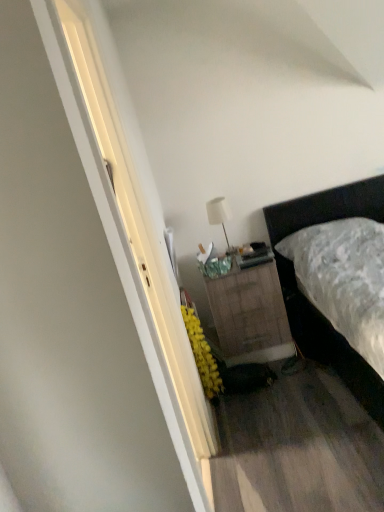
Question: Is dark brown leather bed at right shorter than burlap-textured nightstand at center?

Choices:
 (A) yes
 (B) no

Answer: (B)

Question: Does dark brown leather bed at right lie behind burlap-textured nightstand at center?

Choices:
 (A) yes
 (B) no

Answer: (B)

Question: Is dark brown leather bed at right facing towards burlap-textured nightstand at center?

Choices:
 (A) no
 (B) yes

Answer: (A)

Question: Is dark brown leather bed at right outside burlap-textured nightstand at center?

Choices:
 (A) no
 (B) yes

Answer: (B)

Question: From the image's perspective, is dark brown leather bed at right located above burlap-textured nightstand at center?

Choices:
 (A) yes
 (B) no

Answer: (A)

Question: From the image's perspective, is white matte table lamp at upper center positioned above or below dark brown leather bed at right?

Choices:
 (A) above
 (B) below

Answer: (A)

Question: Is white matte table lamp at upper center to the left or to the right of dark brown leather bed at right in the image?

Choices:
 (A) right
 (B) left

Answer: (B)

Question: Considering the positions of point (223, 224) and point (339, 192), is point (223, 224) closer or farther from the camera than point (339, 192)?

Choices:
 (A) farther
 (B) closer

Answer: (B)

Question: From a real-world perspective, is white matte table lamp at upper center positioned above or below dark brown leather bed at right?

Choices:
 (A) above
 (B) below

Answer: (A)

Question: Is point (210, 219) positioned closer to the camera than point (246, 305)?

Choices:
 (A) farther
 (B) closer

Answer: (A)

Question: From a real-world perspective, is white matte table lamp at upper center positioned above or below burlap-textured nightstand at center?

Choices:
 (A) below
 (B) above

Answer: (B)

Question: In the image, is white matte table lamp at upper center on the left side or the right side of burlap-textured nightstand at center?

Choices:
 (A) right
 (B) left

Answer: (B)

Question: From the image's perspective, relative to burlap-textured nightstand at center, is white matte table lamp at upper center above or below?

Choices:
 (A) below
 (B) above

Answer: (B)

Question: From the image's perspective, is dark brown leather bed at right positioned above or below white matte table lamp at upper center?

Choices:
 (A) above
 (B) below

Answer: (B)

Question: In terms of size, does dark brown leather bed at right appear bigger or smaller than white matte table lamp at upper center?

Choices:
 (A) small
 (B) big

Answer: (B)